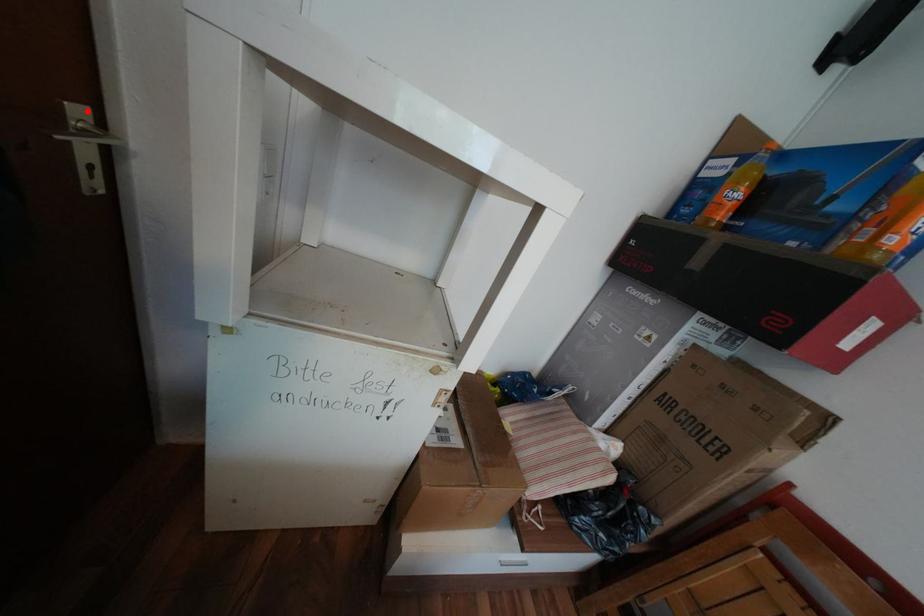
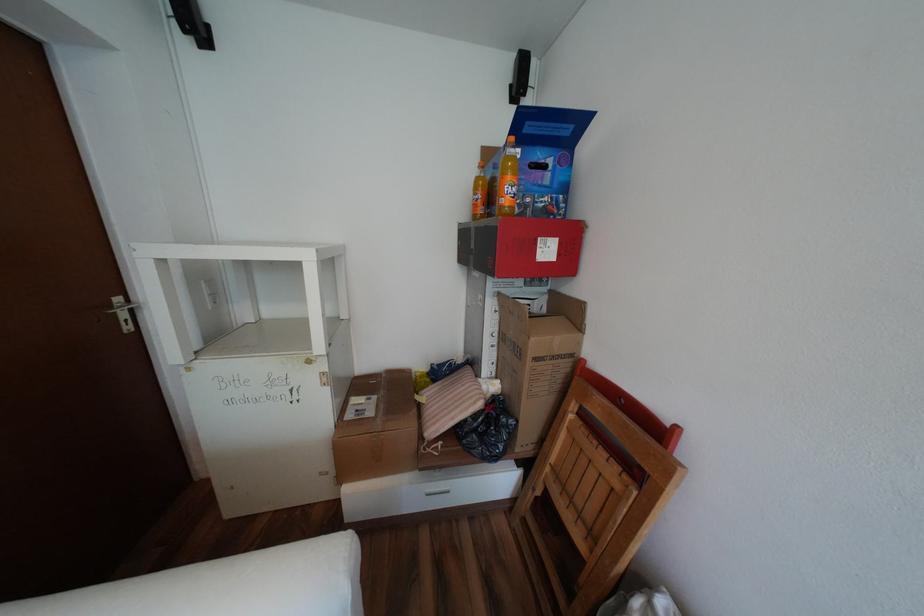
Locate, in the second image, the point that corresponds to the highlighted location in the first image.

(128, 299)